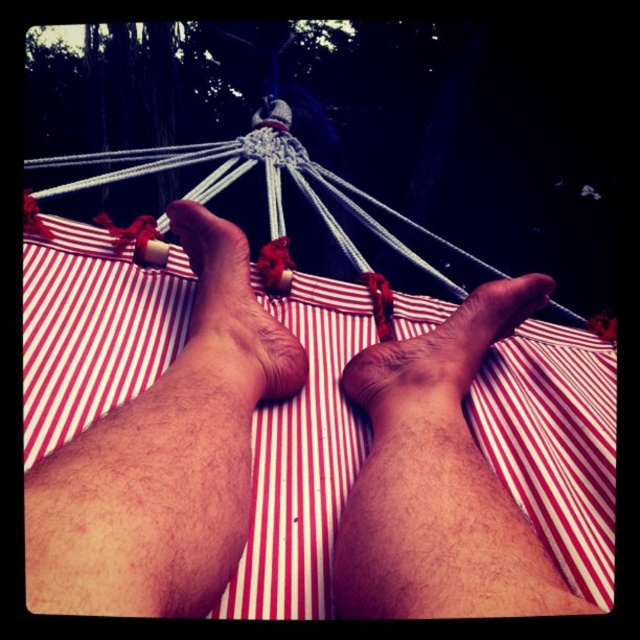
The height and width of the screenshot is (640, 640). Describe the element at coordinates (298, 440) in the screenshot. I see `red striped fabric at center` at that location.

Consider the image. Between red striped fabric at center and red striped fabric foot at center, which one has more height?

Standing taller between the two is red striped fabric at center.

The height and width of the screenshot is (640, 640). Find the location of `red striped fabric at center`. red striped fabric at center is located at coordinates (298, 440).

Which is in front, point (348, 371) or point (467, 353)?

Point (467, 353) is in front.

Identify the location of red striped fabric at center. pos(298,440).

The image size is (640, 640). What are the coordinates of `red striped fabric at center` in the screenshot? It's located at (298, 440).

Which is more to the left, red striped fabric foot at center or brown skin at center?

red striped fabric foot at center

Does red striped fabric foot at center appear under brown skin at center?

No, red striped fabric foot at center is not below brown skin at center.

Describe the element at coordinates (227, 324) in the screenshot. This screenshot has height=640, width=640. I see `red striped fabric foot at center` at that location.

This screenshot has width=640, height=640. Identify the location of red striped fabric foot at center. (227, 324).